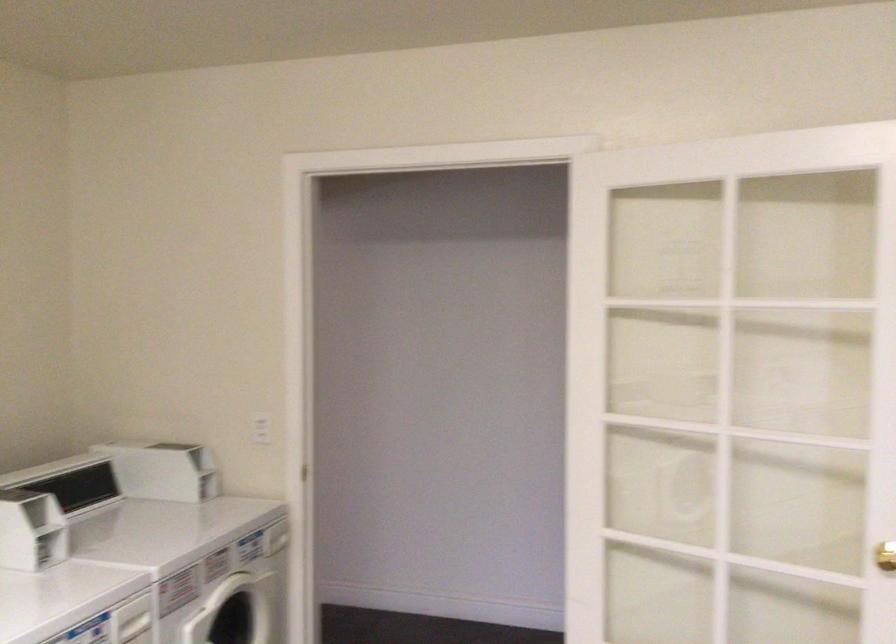
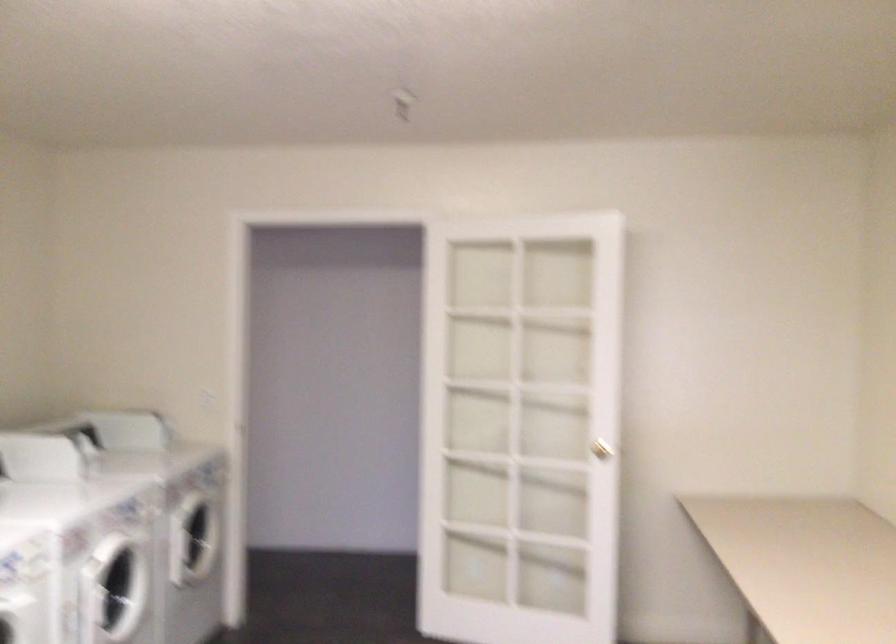
Question: Which direction would the cameraman need to move to produce the second image? Reply with the corresponding letter.

Choices:
 (A) Left
 (B) Right
 (C) Forward
 (D) Backward

Answer: (D)